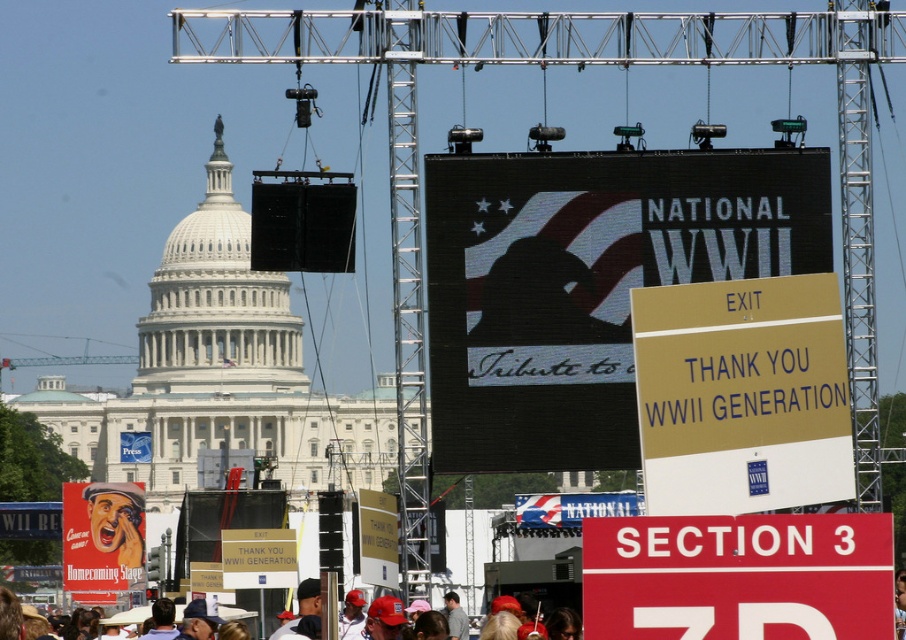
Does point (467, 636) come behind point (118, 614)?

No, (467, 636) is closer to viewer.

Is point (458, 636) behind point (128, 621)?

No, it is in front of (128, 621).

Locate an element on the screen. The width and height of the screenshot is (906, 640). denim jacket at lower center is located at coordinates (455, 618).

Does metallic helmet at center have a lesser height compared to red fabric hats at lower center?

Incorrect, metallic helmet at center's height does not fall short of red fabric hats at lower center's.

Describe the element at coordinates (352, 616) in the screenshot. The height and width of the screenshot is (640, 906). I see `metallic helmet at center` at that location.

This screenshot has width=906, height=640. In order to click on metallic helmet at center in this screenshot , I will do `click(352, 616)`.

Locate an element on the screen. The height and width of the screenshot is (640, 906). metallic helmet at center is located at coordinates (352, 616).

Who is higher up, red plastic sign at lower right or denim jacket at lower center?

red plastic sign at lower right is above.

Between red plastic sign at lower right and denim jacket at lower center, which one appears on the right side from the viewer's perspective?

Positioned to the right is red plastic sign at lower right.

The height and width of the screenshot is (640, 906). In order to click on red plastic sign at lower right in this screenshot , I will do `click(738, 577)`.